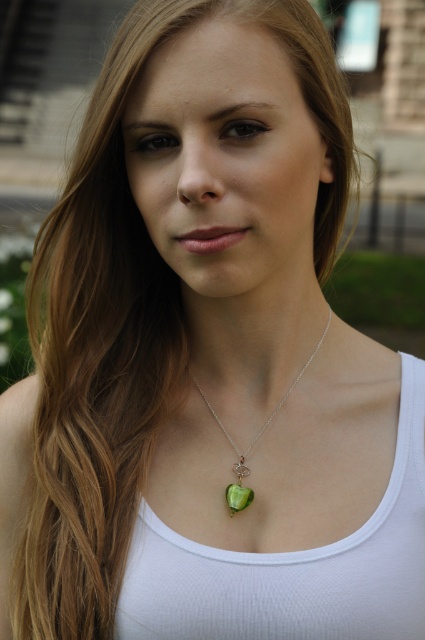
Is green glass pendant at center thinner than green gemstone pendant at center?

In fact, green glass pendant at center might be wider than green gemstone pendant at center.

Between green glass pendant at center and green gemstone pendant at center, which one appears on the right side from the viewer's perspective?

green glass pendant at center

Which is behind, point (243, 470) or point (243, 476)?

Point (243, 470)

Where is `green glass pendant at center`? green glass pendant at center is located at coordinates (252, 442).